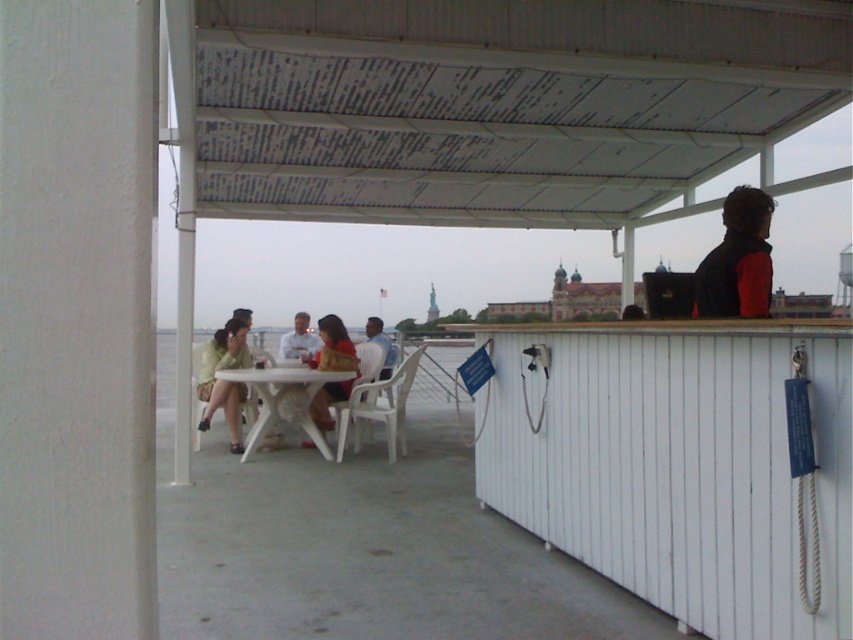
Question: Which point is farther to the camera?

Choices:
 (A) matte white shirt at center
 (B) light brown wooden chair at center
 (C) white plastic table at center
 (D) matte yellow shirt at center

Answer: (B)

Question: In this image, where is matte yellow shirt at center located relative to light brown wooden chair at center?

Choices:
 (A) above
 (B) below

Answer: (B)

Question: Which of the following is the farthest from the observer?

Choices:
 (A) white plastic table at center
 (B) red fleece jacket at right
 (C) matte white shirt at center
 (D) matte yellow shirt at center

Answer: (C)

Question: Does red fleece jacket at right appear under light brown wooden chair at center?

Choices:
 (A) no
 (B) yes

Answer: (A)

Question: Is red fleece jacket at right below white plastic table at center?

Choices:
 (A) yes
 (B) no

Answer: (B)

Question: Which point is farther to the camera?

Choices:
 (A) (381, 323)
 (B) (294, 317)
 (C) (291, 390)

Answer: (A)